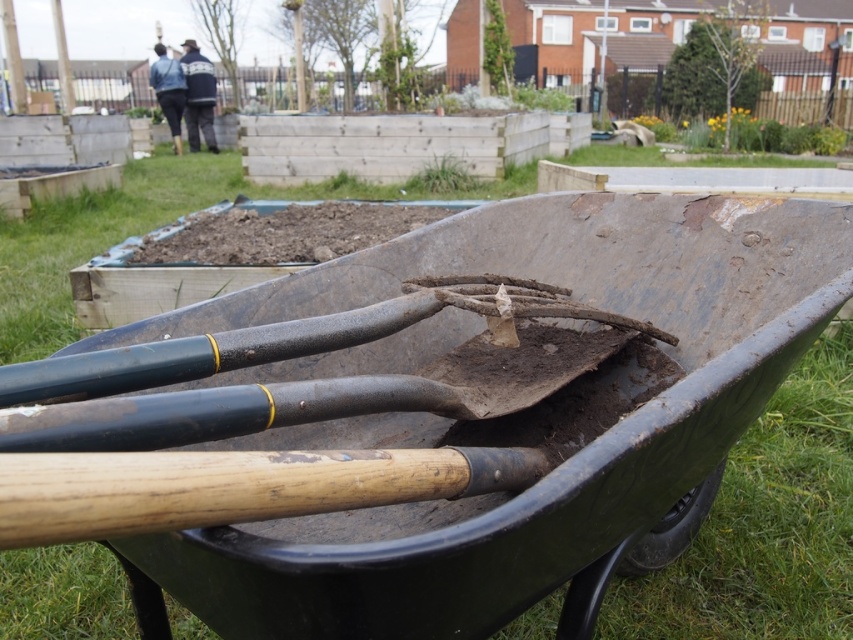
Based on the photo, you are a gardener who needs to move the brown soil at center to another location. Can you use the green rubber cart at center to transport it? Explain why or why not based on their positions.

The green rubber cart at center is below brown soil at center, so yes, you can use the green rubber cart at center to transport the brown soil at center since the soil is already positioned on top of the cart.

You are a gardener standing near the green rubber cart at center and the brown soil at center. Which object is nearer to you?

The green rubber cart at center is closer to the viewer than the brown soil at center.